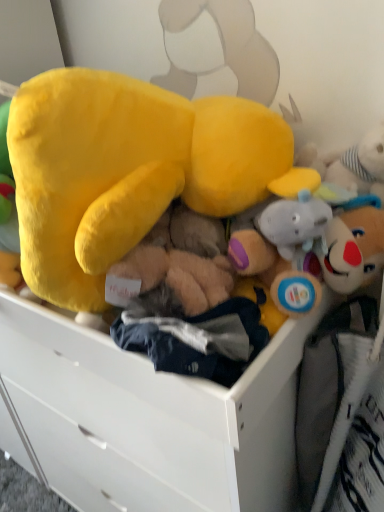
This screenshot has height=512, width=384. Identify the location of fluffy yellow plush at center. (129, 170).

What do you see at coordinates (129, 170) in the screenshot? I see `fluffy yellow plush at center` at bounding box center [129, 170].

What is the approximate height of fluffy yellow plush at center?

17.73 inches.

Describe the element at coordinates (151, 418) in the screenshot. I see `white matte drawer at center` at that location.

The height and width of the screenshot is (512, 384). In order to click on white matte drawer at center in this screenshot , I will do `click(151, 418)`.

Measure the distance between point (296, 325) and camera.

Point (296, 325) is 28.35 inches away from camera.

Locate an element on the screen. fluffy yellow plush at center is located at coordinates (129, 170).

Which object is positioned more to the right, white matte drawer at center or fluffy yellow plush at center?

From the viewer's perspective, white matte drawer at center appears more on the right side.

Is white matte drawer at center closer to camera compared to fluffy yellow plush at center?

No, the depth of white matte drawer at center is greater than that of fluffy yellow plush at center.

Does point (84, 416) come in front of point (123, 225)?

That is False.

Consider the image. From the image's perspective, is white matte drawer at center located beneath fluffy yellow plush at center?

Correct, white matte drawer at center appears lower than fluffy yellow plush at center in the image.

From a real-world perspective, is white matte drawer at center positioned over fluffy yellow plush at center based on gravity?

No, from a real-world perspective, white matte drawer at center is not over fluffy yellow plush at center

Considering the relative sizes of white matte drawer at center and fluffy yellow plush at center in the image provided, is white matte drawer at center wider than fluffy yellow plush at center?

Yes.

Which of these two, white matte drawer at center or fluffy yellow plush at center, stands taller?

With more height is white matte drawer at center.

Looking at the image, does white matte drawer at center seem bigger or smaller compared to fluffy yellow plush at center?

Clearly, white matte drawer at center is larger in size than fluffy yellow plush at center.

Can fluffy yellow plush at center be found inside white matte drawer at center?

No, fluffy yellow plush at center is not surrounded by white matte drawer at center.

Is the surface of white matte drawer at center in direct contact with fluffy yellow plush at center?

No, white matte drawer at center is not with fluffy yellow plush at center.

Is fluffy yellow plush at center at the back of white matte drawer at center?

No, fluffy yellow plush at center is not at the back of white matte drawer at center.

The height and width of the screenshot is (512, 384). I want to click on toy on the left of white matte drawer at center, so click(x=129, y=170).

Can you confirm if fluffy yellow plush at center is positioned to the left of white matte drawer at center?

Yes, fluffy yellow plush at center is to the left of white matte drawer at center.

Based on the photo, considering their positions, is fluffy yellow plush at center located in front of or behind white matte drawer at center?

fluffy yellow plush at center is in front of white matte drawer at center.

Does point (121, 218) lie behind point (187, 409)?

No, it is in front of (187, 409).

From the image's perspective, who appears lower, fluffy yellow plush at center or white matte drawer at center?

From the image's view, white matte drawer at center is below.

From a real-world perspective, which object rests below the other?

white matte drawer at center, from a real-world perspective.

Is fluffy yellow plush at center wider than white matte drawer at center?

Incorrect, the width of fluffy yellow plush at center does not surpass that of white matte drawer at center.

In the scene shown: Considering the sizes of objects fluffy yellow plush at center and white matte drawer at center in the image provided, who is shorter, fluffy yellow plush at center or white matte drawer at center?

With less height is fluffy yellow plush at center.

Does fluffy yellow plush at center have a smaller size compared to white matte drawer at center?

Indeed, fluffy yellow plush at center has a smaller size compared to white matte drawer at center.

Is fluffy yellow plush at center situated inside white matte drawer at center or outside?

fluffy yellow plush at center is spatially situated outside white matte drawer at center.

Does fluffy yellow plush at center touch white matte drawer at center?

No, fluffy yellow plush at center is not with white matte drawer at center.

Could you tell me if fluffy yellow plush at center is turned towards white matte drawer at center?

No, fluffy yellow plush at center is not aimed at white matte drawer at center.

What's the angular difference between fluffy yellow plush at center and white matte drawer at center's facing directions?

fluffy yellow plush at center and white matte drawer at center are facing 0.000897 degrees away from each other.

I want to click on drawer that is under the fluffy yellow plush at center (from a real-world perspective), so click(x=151, y=418).

Find the location of a particular element. This screenshot has height=512, width=384. drawer below the fluffy yellow plush at center (from the image's perspective) is located at coordinates (151, 418).

Locate an element on the screen. Image resolution: width=384 pixels, height=512 pixels. toy in front of the white matte drawer at center is located at coordinates (129, 170).